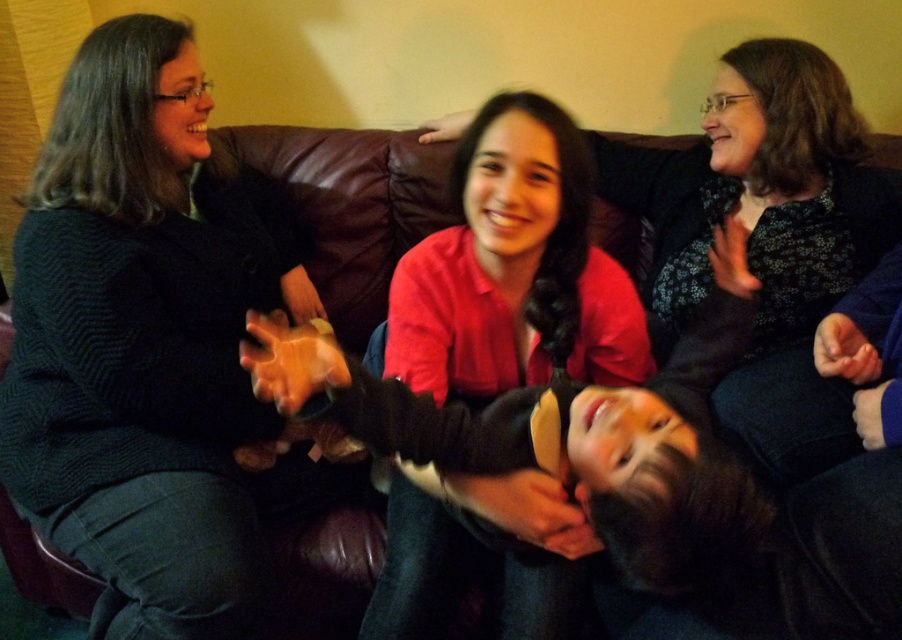
Question: Can you confirm if black sweater at left is positioned below matte red shirt at center?

Choices:
 (A) no
 (B) yes

Answer: (A)

Question: Among these objects, which one is nearest to the camera?

Choices:
 (A) matte red shirt at center
 (B) black sweater at left

Answer: (A)

Question: Among these objects, which one is nearest to the camera?

Choices:
 (A) black sweater at left
 (B) matte red shirt at center

Answer: (B)

Question: Is black sweater at left smaller than matte red shirt at center?

Choices:
 (A) yes
 (B) no

Answer: (B)

Question: Which point appears closest to the camera in this image?

Choices:
 (A) (559, 300)
 (B) (69, 76)

Answer: (A)

Question: Is black sweater at left further to the viewer compared to matte red shirt at center?

Choices:
 (A) yes
 (B) no

Answer: (A)